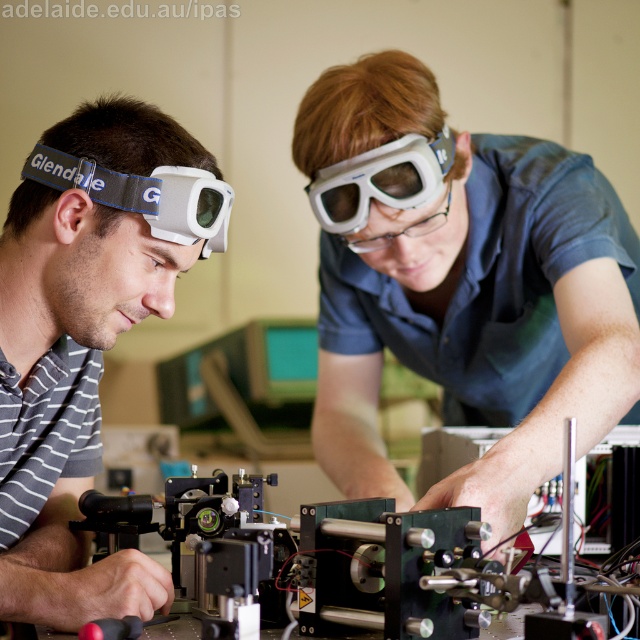
You are a safety inspector in a lab. You need to ensure that all protective eyewear is kept at least 10 inches away from any machinery to prevent accidental contact. Are the matte white goggles at center and the metallic black mechanical device at center compliant with this safety regulation?

The matte white goggles at center is 9.37 inches away from the metallic black mechanical device at center, which is less than the required 10 inches. Therefore, they are not compliant with the safety regulation.

You are a safety inspector in the lab. You need to ensure that all protective equipment is properly positioned. Where exactly are the white matte goggles at left located in the image?

The white matte goggles at left are located at point (72, 388) in the image.